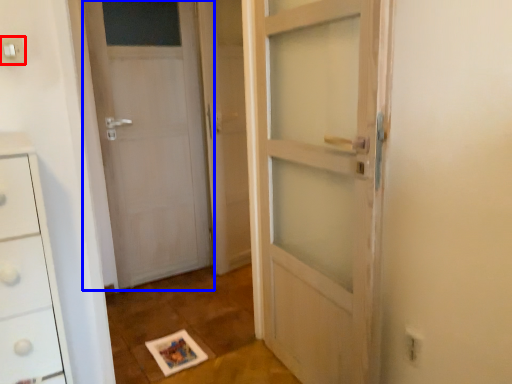
Question: Among these objects, which one is farthest to the camera, electric outlet (highlighted by a red box) or door (highlighted by a blue box)?

Choices:
 (A) electric outlet
 (B) door

Answer: (B)